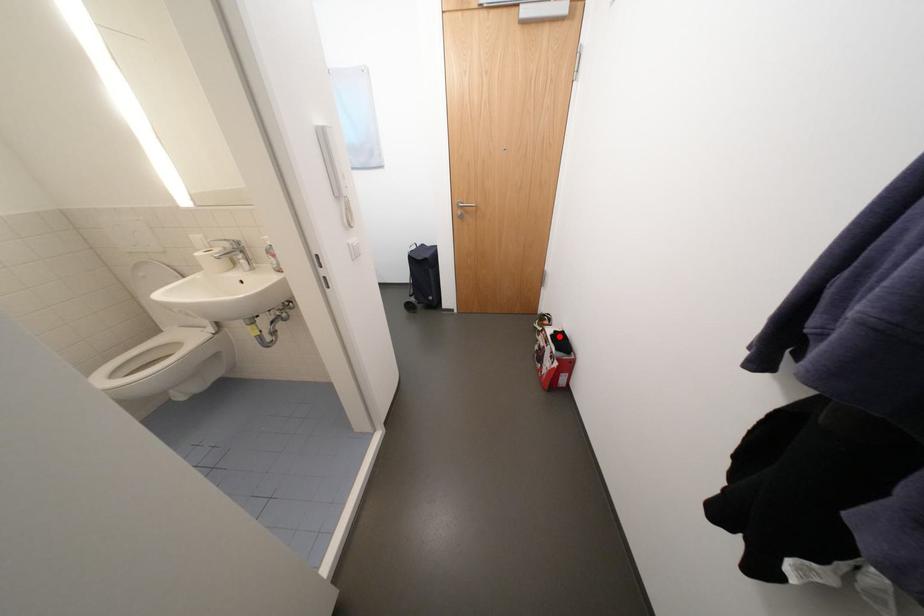
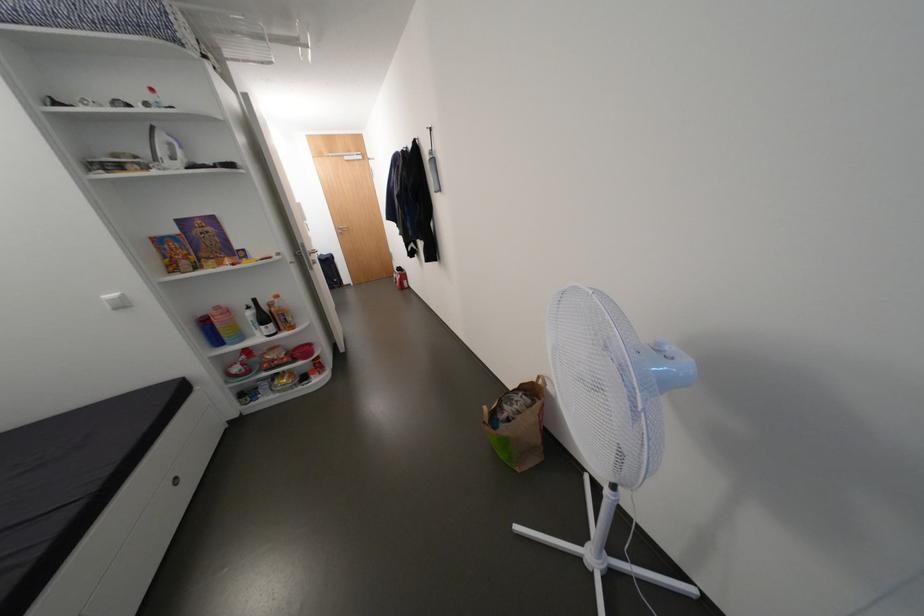
Question: I am providing you with two images of the same scene from different viewpoints. Given a red point in image1, look at the same physical point in image2. Is it:

Choices:
 (A) Closer to the viewpoint
 (B) Farther from the viewpoint

Answer: (B)